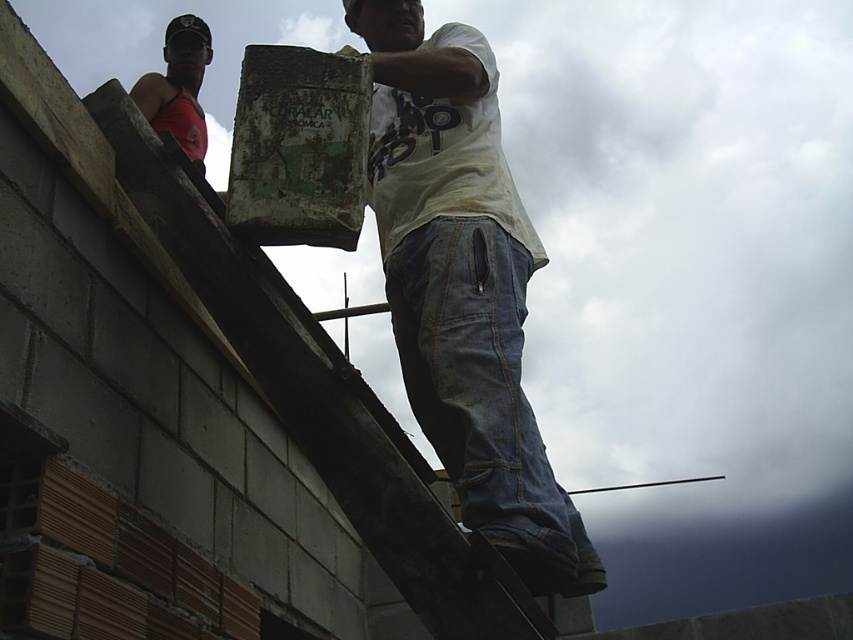
Question: Which of the following is the farthest from the observer?

Choices:
 (A) white cotton shirt at center
 (B) matte red tank top at upper left

Answer: (B)

Question: Is white cotton shirt at center further to the viewer compared to matte red tank top at upper left?

Choices:
 (A) no
 (B) yes

Answer: (A)

Question: Is white cotton shirt at center positioned behind matte red tank top at upper left?

Choices:
 (A) no
 (B) yes

Answer: (A)

Question: Does white cotton shirt at center appear under matte red tank top at upper left?

Choices:
 (A) no
 (B) yes

Answer: (B)

Question: Which object is closer to the camera taking this photo?

Choices:
 (A) white cotton shirt at center
 (B) matte red tank top at upper left

Answer: (A)